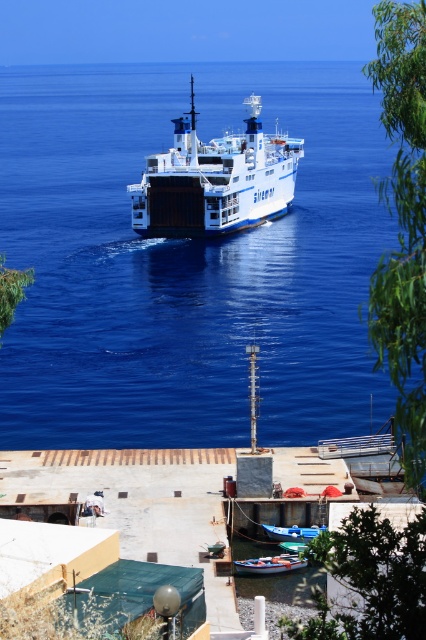
Where is `blue liquid water at center`? blue liquid water at center is located at coordinates (187, 262).

Does blue liquid water at center appear under wooden boat at lower center?

Incorrect, blue liquid water at center is not positioned below wooden boat at lower center.

Between point (348, 220) and point (302, 560), which one is positioned behind?

Point (348, 220)

At what (x,y) coordinates should I click in order to perform the action: click on blue liquid water at center. Please return your answer as a coordinate pair (x, y). The image size is (426, 640). Looking at the image, I should click on (187, 262).

Can you confirm if wooden boat at lower center is taller than blue matte boat at lower center?

Yes, wooden boat at lower center is taller than blue matte boat at lower center.

The width and height of the screenshot is (426, 640). Find the location of `wooden boat at lower center`. wooden boat at lower center is located at coordinates tap(270, 564).

The width and height of the screenshot is (426, 640). Identify the location of wooden boat at lower center. (270, 564).

Where is `blue liquid water at center`? The height and width of the screenshot is (640, 426). blue liquid water at center is located at coordinates (187, 262).

Can you confirm if blue liquid water at center is positioned to the right of white matte ferry at center?

In fact, blue liquid water at center is to the left of white matte ferry at center.

Is point (111, 259) behind point (227, 186)?

Yes, point (111, 259) is behind point (227, 186).

Image resolution: width=426 pixels, height=640 pixels. Identify the location of blue liquid water at center. (187, 262).